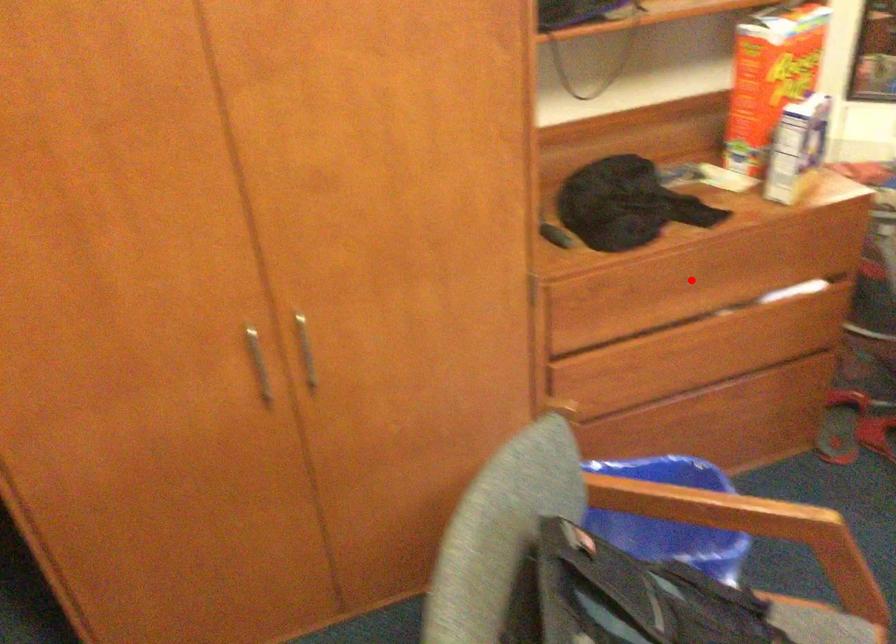
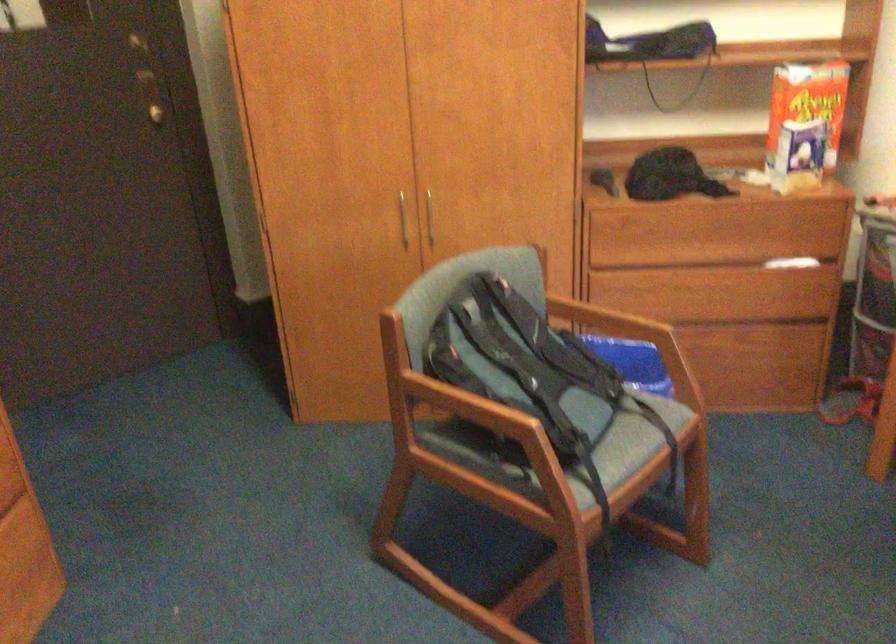
Locate, in the second image, the point that corresponds to the highlighted location in the first image.

(702, 232)